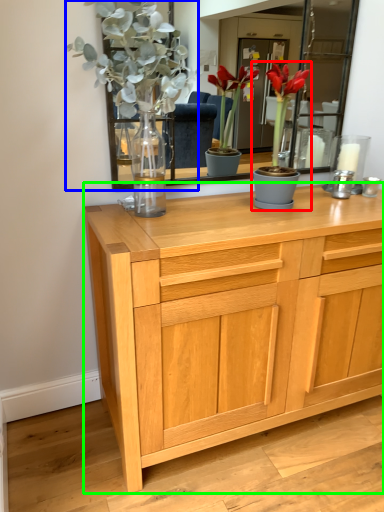
Question: Based on their relative distances, which object is farther from houseplant (highlighted by a red box)? Choose from floral arrangement (highlighted by a blue box) and chest of drawers (highlighted by a green box).

Choices:
 (A) floral arrangement
 (B) chest of drawers

Answer: (B)